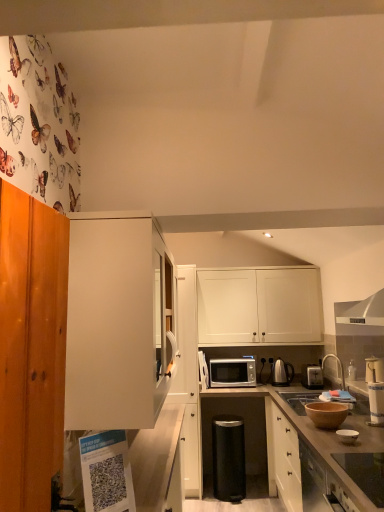
Question: From the image's perspective, is smooth glass cooktop at lower right, arranged as the fifth appliance when viewed from the back, beneath silver metallic toaster at right?

Choices:
 (A) no
 (B) yes

Answer: (A)

Question: Is smooth glass cooktop at lower right, which is the 2th appliance from top to bottom, placed right next to silver metallic toaster at right?

Choices:
 (A) yes
 (B) no

Answer: (B)

Question: Is smooth glass cooktop at lower right, arranged as the fifth appliance when viewed from the back, to the right of silver metallic toaster at right from the viewer's perspective?

Choices:
 (A) yes
 (B) no

Answer: (B)

Question: Can you confirm if smooth glass cooktop at lower right, which ranks as the fourth appliance in bottom-to-top order, is bigger than silver metallic toaster at right?

Choices:
 (A) no
 (B) yes

Answer: (A)

Question: Considering the relative sizes of smooth glass cooktop at lower right, which ranks as the fourth appliance in bottom-to-top order, and silver metallic toaster at right in the image provided, is smooth glass cooktop at lower right, which ranks as the fourth appliance in bottom-to-top order, thinner than silver metallic toaster at right?

Choices:
 (A) yes
 (B) no

Answer: (A)

Question: From a real-world perspective, is smooth glass cooktop at lower right, which is the 2th appliance from top to bottom, below silver metallic toaster at right?

Choices:
 (A) yes
 (B) no

Answer: (A)

Question: Is silver metallic faucet at upper right facing away from metallic electric kettle at center-right, the 1th appliance when ordered from back to front?

Choices:
 (A) yes
 (B) no

Answer: (B)

Question: Does silver metallic faucet at upper right come behind metallic electric kettle at center-right, positioned as the 5th appliance in front-to-back order?

Choices:
 (A) no
 (B) yes

Answer: (A)

Question: Is silver metallic faucet at upper right placed right next to metallic electric kettle at center-right, which is the 4th appliance from left to right?

Choices:
 (A) no
 (B) yes

Answer: (A)

Question: Is silver metallic faucet at upper right not within metallic electric kettle at center-right, positioned as the 5th appliance in front-to-back order?

Choices:
 (A) yes
 (B) no

Answer: (A)

Question: Considering the relative sizes of silver metallic faucet at upper right and metallic electric kettle at center-right, which is the 4th appliance from left to right, in the image provided, is silver metallic faucet at upper right bigger than metallic electric kettle at center-right, which is the 4th appliance from left to right,?

Choices:
 (A) yes
 (B) no

Answer: (A)

Question: Is silver metallic faucet at upper right facing towards metallic electric kettle at center-right, the second appliance from the bottom?

Choices:
 (A) yes
 (B) no

Answer: (B)

Question: Is smooth glass cooktop at lower right, which ranks as the fourth appliance in bottom-to-top order, positioned before silver metallic faucet at upper right?

Choices:
 (A) no
 (B) yes

Answer: (B)